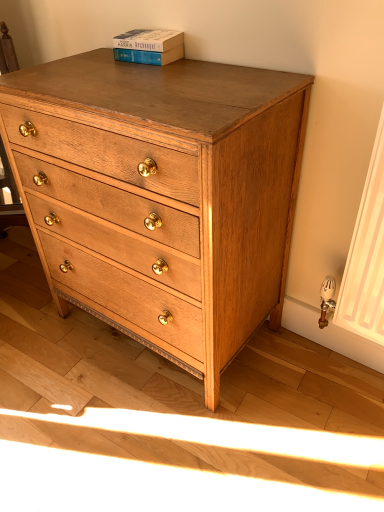
Identify the location of vacant space in front of natural wood chest of drawers at center. (168, 438).